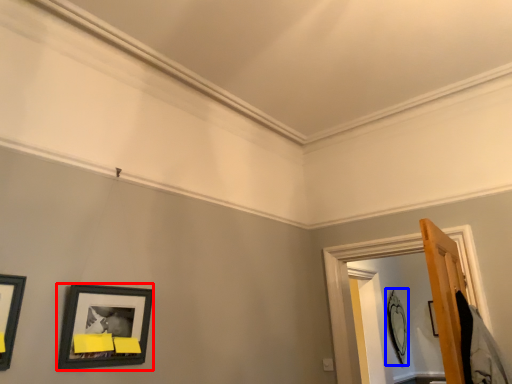
Question: Which object is closer to the camera taking this photo, picture frame (highlighted by a red box) or picture frame (highlighted by a blue box)?

Choices:
 (A) picture frame
 (B) picture frame

Answer: (A)